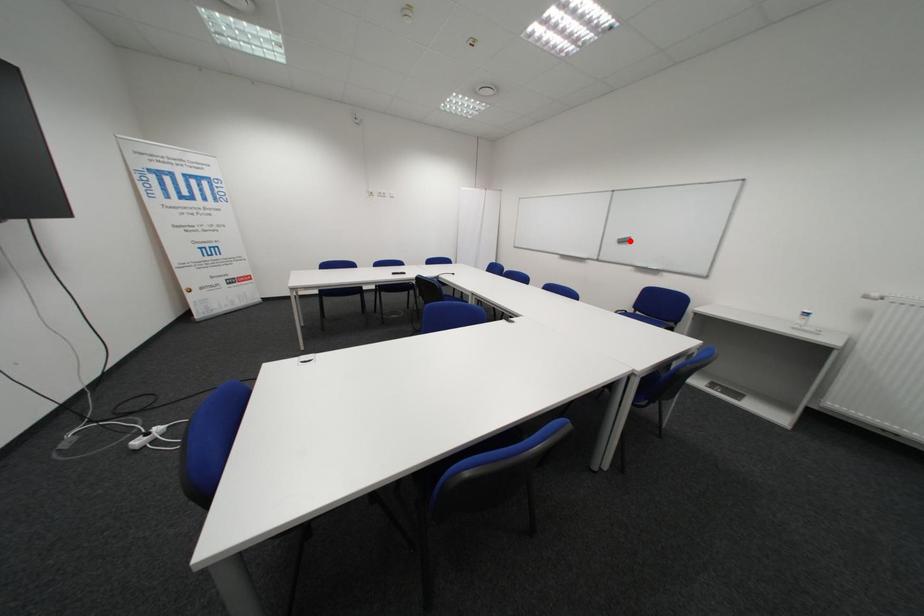
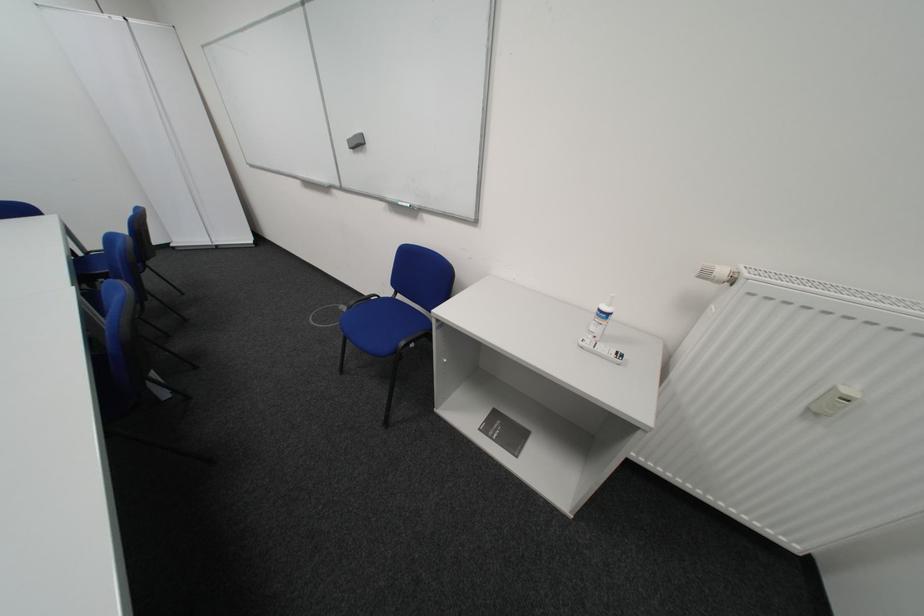
Where in the second image is the point corresponding to the highlighted location from the first image?

(361, 143)